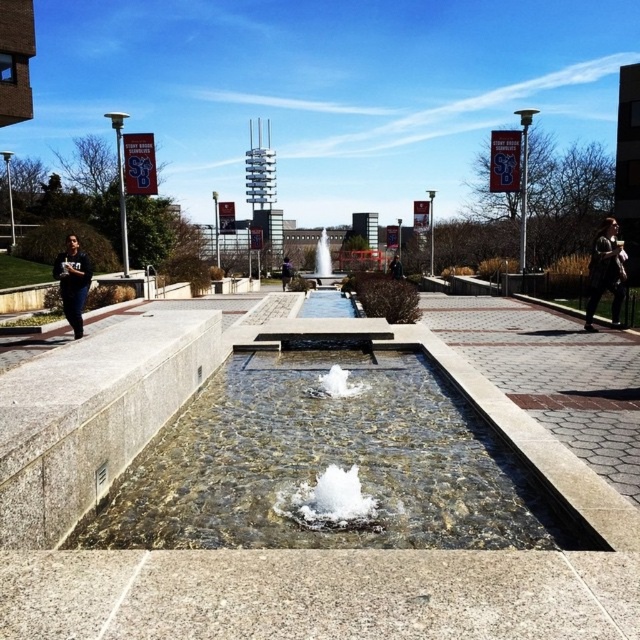
Question: Can you confirm if dark brown leather jacket at right is positioned below black fabric jacket at center?

Choices:
 (A) no
 (B) yes

Answer: (B)

Question: Is black fabric jacket at center thinner than black fabric person at center?

Choices:
 (A) yes
 (B) no

Answer: (B)

Question: Which object is positioned closest to the black fabric person at center?

Choices:
 (A) dark brown leather jacket at right
 (B) black fabric jacket at center
 (C) clear glass water at center
 (D) dark blue jeans at left

Answer: (B)

Question: Which of the following is the farthest from the observer?

Choices:
 (A) dark blue jeans at left
 (B) clear glass water at center
 (C) black fabric jacket at center

Answer: (C)

Question: Which of the following is the farthest from the observer?

Choices:
 (A) black fabric jacket at center
 (B) clear glass water at center
 (C) dark brown leather jacket at right

Answer: (A)

Question: Does black fabric jacket at center appear over black fabric person at center?

Choices:
 (A) yes
 (B) no

Answer: (A)